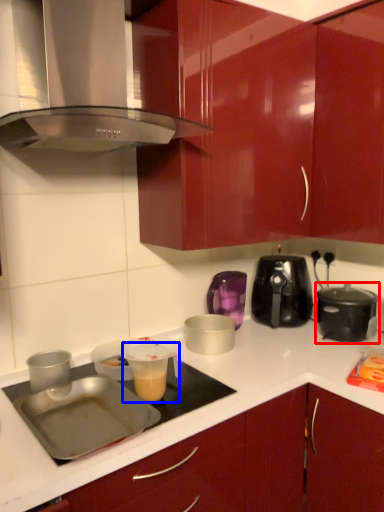
Question: Which of the following is the farthest to the observer, kitchen appliance (highlighted by a red box) or appliance (highlighted by a blue box)?

Choices:
 (A) kitchen appliance
 (B) appliance

Answer: (A)